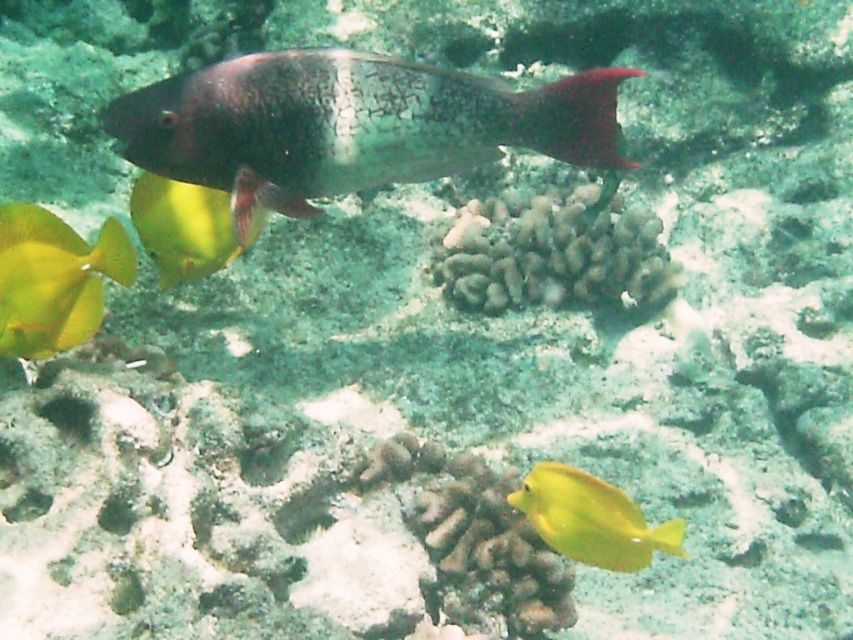
Between point (445, 260) and point (129, 205), which one is positioned behind?

The point (445, 260) is behind.

Who is more distant from viewer, (450,252) or (184,204)?

Positioned behind is point (450,252).

At what (x,y) coordinates should I click in order to perform the action: click on bumpy coral at center. Please return your answer as a coordinate pair (x, y). The width and height of the screenshot is (853, 640). Looking at the image, I should click on (554, 253).

Can you confirm if smooth yellow fish at left is smaller than shiny yellow fish at lower left?

Indeed, smooth yellow fish at left has a smaller size compared to shiny yellow fish at lower left.

Which is more to the left, smooth yellow fish at left or shiny yellow fish at lower left?

smooth yellow fish at left

This screenshot has width=853, height=640. What do you see at coordinates (54, 280) in the screenshot? I see `smooth yellow fish at left` at bounding box center [54, 280].

In order to click on smooth yellow fish at left in this screenshot , I will do `click(54, 280)`.

Who is higher up, bumpy coral at center or smooth yellow fish at left?

Positioned higher is bumpy coral at center.

Between bumpy coral at center and smooth yellow fish at left, which one appears on the left side from the viewer's perspective?

smooth yellow fish at left

Who is more forward, [561,298] or [122,248]?

Point [122,248] is in front.

Where is `bumpy coral at center`? This screenshot has width=853, height=640. bumpy coral at center is located at coordinates (554, 253).